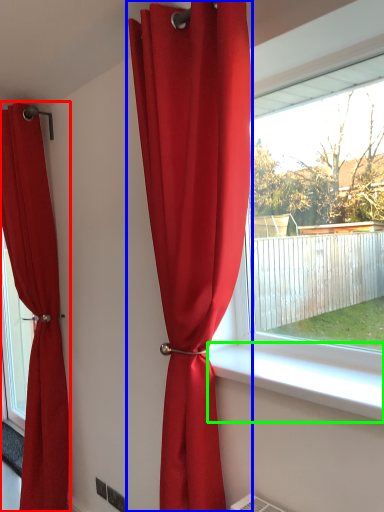
Question: Considering the real-world distances, which object is farthest from curtain (highlighted by a red box)? curtain (highlighted by a blue box) or window sill (highlighted by a green box)?

Choices:
 (A) curtain
 (B) window sill

Answer: (B)